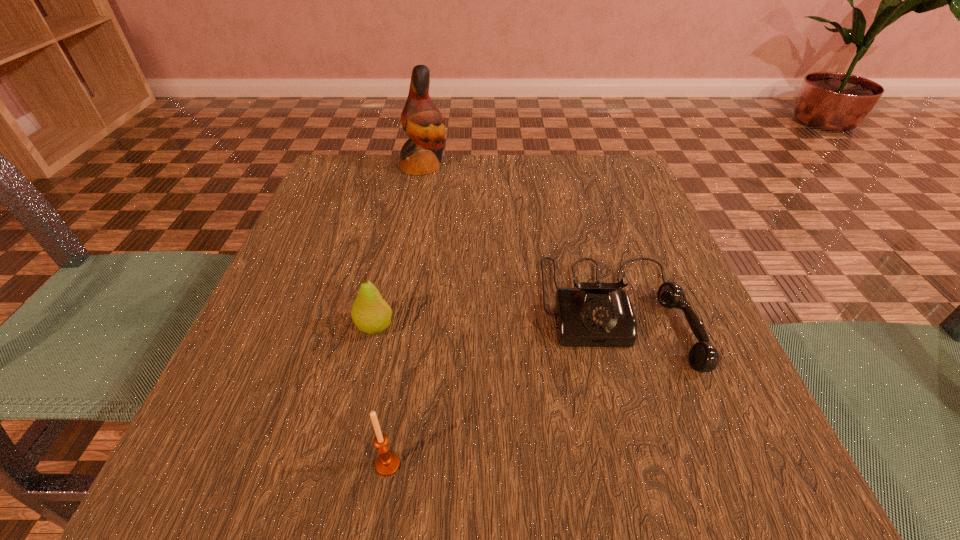
Where is `object at the far edge`? This screenshot has width=960, height=540. object at the far edge is located at coordinates (421, 120).

This screenshot has width=960, height=540. In order to click on object present at the near edge in this screenshot , I will do `click(387, 463)`.

In order to click on object located in the right edge section of the desktop in this screenshot , I will do `click(598, 314)`.

Locate an element on the screen. This screenshot has height=540, width=960. free region at the far edge is located at coordinates (437, 207).

Locate an element on the screen. Image resolution: width=960 pixels, height=540 pixels. free point at the near edge is located at coordinates (470, 500).

The image size is (960, 540). I want to click on free space at the left edge of the desktop, so click(x=296, y=245).

This screenshot has height=540, width=960. What are the coordinates of `vacant space at the right edge of the desktop` in the screenshot? It's located at (619, 253).

At what (x,y) coordinates should I click in order to perform the action: click on vacant space at the far left corner of the desktop. Please return your answer as a coordinate pair (x, y). This screenshot has height=540, width=960. Looking at the image, I should click on (356, 166).

This screenshot has height=540, width=960. In order to click on free space at the far right corner of the desktop in this screenshot , I will do `click(598, 165)`.

Locate an element on the screen. vacant region at the near right corner of the desktop is located at coordinates (694, 437).